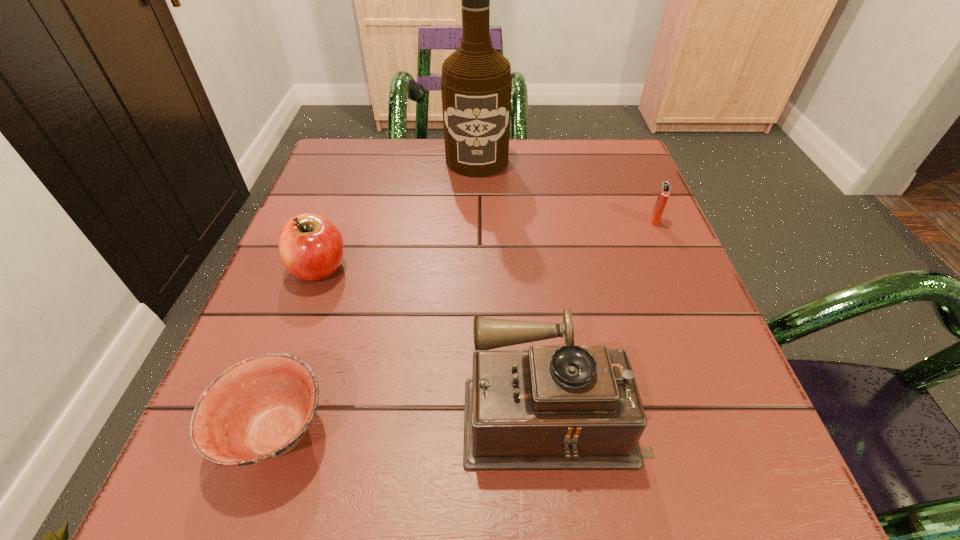
Find the location of a particular element. The width and height of the screenshot is (960, 540). phonograph_record present at the right edge is located at coordinates (553, 407).

Locate an element on the screen. igniter that is at the right edge is located at coordinates (664, 192).

Where is `object at the near left corner`? The image size is (960, 540). object at the near left corner is located at coordinates pos(257,410).

You are a GUI agent. You are given a task and a screenshot of the screen. Output one action in this format:
    pyautogui.click(x=<x>, y=<y>)
    Task: Click on the object that is at the near right corner
    The height and width of the screenshot is (540, 960).
    Given the screenshot: What is the action you would take?
    pyautogui.click(x=553, y=407)

Identify the location of vacant space at the far edge of the desktop. The height and width of the screenshot is (540, 960). (432, 191).

In the image, there is a desktop. Identify the location of vacant space at the near edge. This screenshot has height=540, width=960. (636, 471).

Identify the location of blank area at the left edge. This screenshot has height=540, width=960. (316, 425).

Find the location of a particular element. The height and width of the screenshot is (540, 960). vacant point at the right edge is located at coordinates (646, 281).

The height and width of the screenshot is (540, 960). In the image, there is a desktop. What are the coordinates of `vacant space at the far left corner` in the screenshot? It's located at (393, 152).

This screenshot has height=540, width=960. I want to click on free space at the far right corner of the desktop, so click(588, 146).